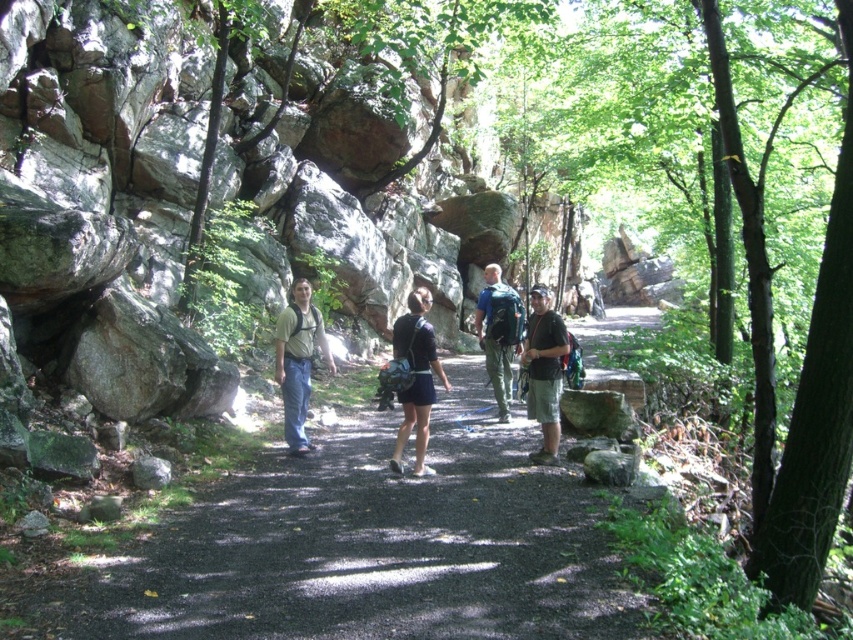
You are standing on the black asphalt path at center and want to hand a map to the person wearing the matte khaki shirt at center. Since both objects are at center, which direction should you move to reach the person?

The black asphalt path at center is closer to the viewer than the matte khaki shirt at center, so you should move backward to reach the person wearing the matte khaki shirt at center.

You are a hiker who just noticed your matte black backpack at center and camouflage shorts at center in the image. Which item is positioned lower from the ground?

The matte black backpack at center is positioned below the camouflage shorts at center, so it is lower to the ground.